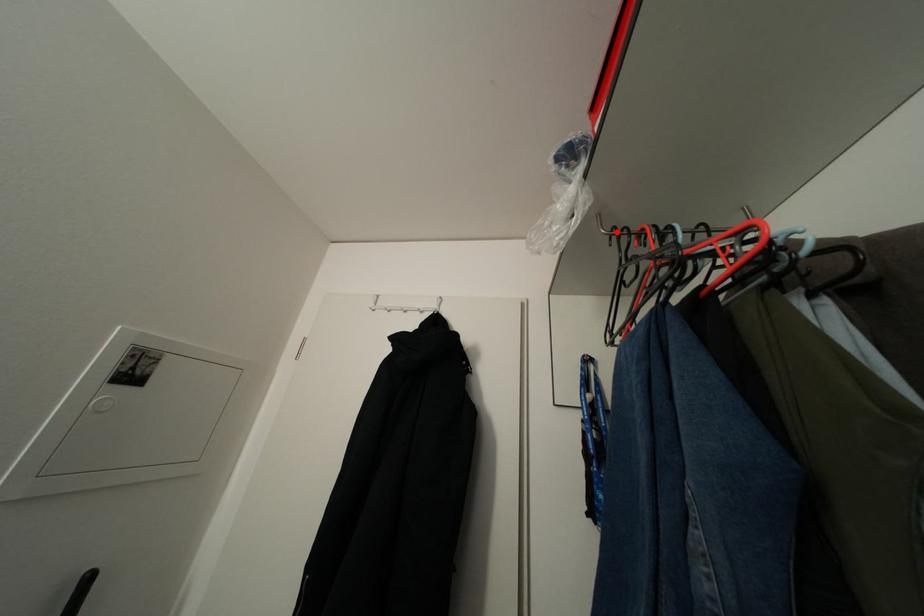
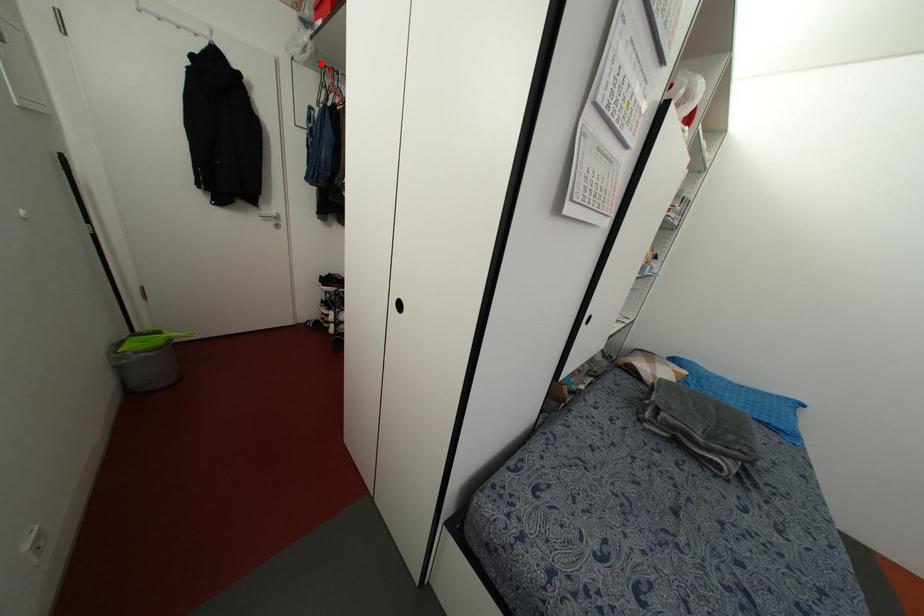
I am providing you with two images of the same scene from different viewpoints. A red point is marked on the first image and another point is marked on the second image. Do the highlighted points in image1 and image2 indicate the same real-world spot?

Yes